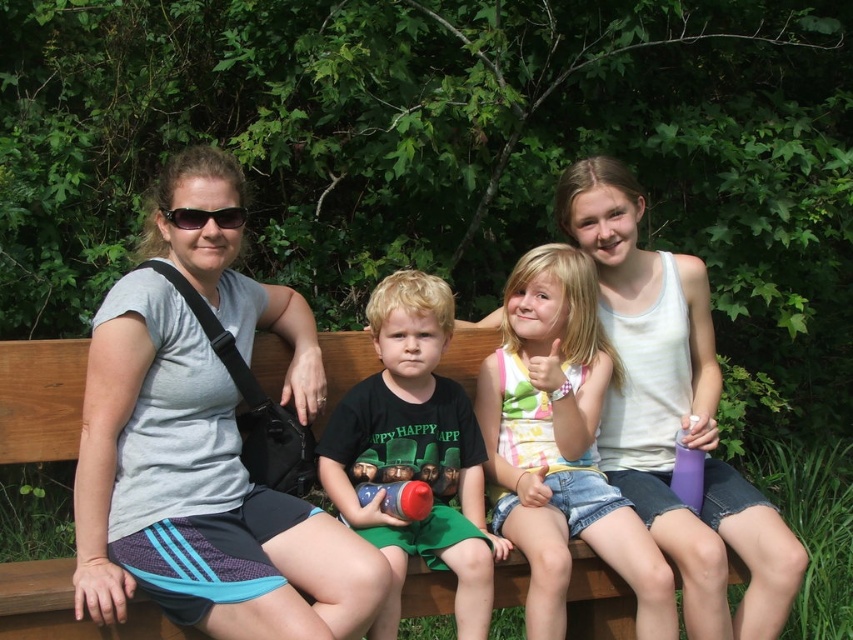
Question: Which point is closer to the camera?

Choices:
 (A) (496, 456)
 (B) (737, 474)
 (C) (171, 218)

Answer: (C)

Question: Which point appears closest to the camera in this image?

Choices:
 (A) (172, 212)
 (B) (677, 406)
 (C) (556, 540)

Answer: (A)

Question: Considering the relative positions of gray fabric shirt at left and green matte shirt at center in the image provided, where is gray fabric shirt at left located with respect to green matte shirt at center?

Choices:
 (A) left
 (B) right

Answer: (A)

Question: Is gray fabric shirt at upper left bigger than white tank top at center?

Choices:
 (A) yes
 (B) no

Answer: (B)

Question: Which object is farther from the camera taking this photo?

Choices:
 (A) gray fabric shirt at upper left
 (B) white tank top at center
 (C) green matte shirt at center

Answer: (B)

Question: Does gray fabric shirt at upper left have a larger size compared to striped cotton shirt at center?

Choices:
 (A) no
 (B) yes

Answer: (B)